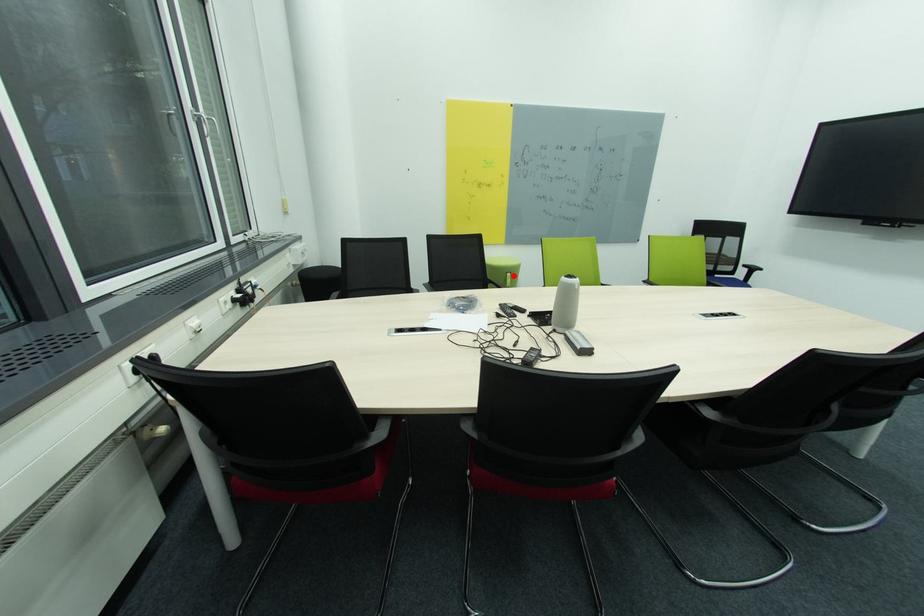
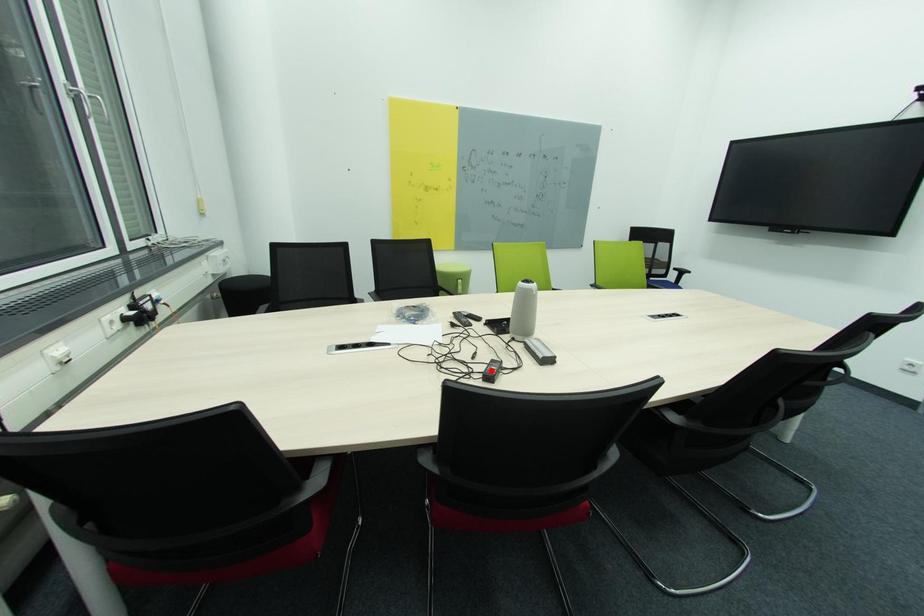
I am providing you with two images of the same scene from different viewpoints. A red point is marked on the first image and another point is marked on the second image. Is the marked point in image1 the same physical position as the marked point in image2?

No